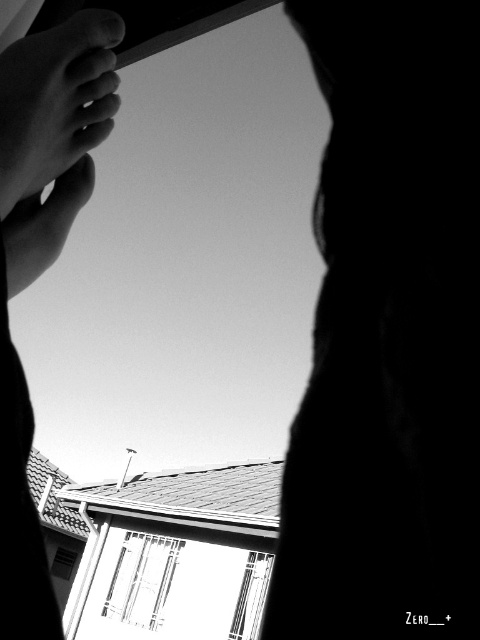
Consider the image. You are a photographer trying to capture the silhouette of the person in the image. The camera is positioned at the point marked as point (56, 100). Where should you aim to ensure the silhouette is fully visible?

The point (56, 100) is on matte skin at upper left, so you should aim towards the upper left area where the person is positioned to capture their silhouette fully.